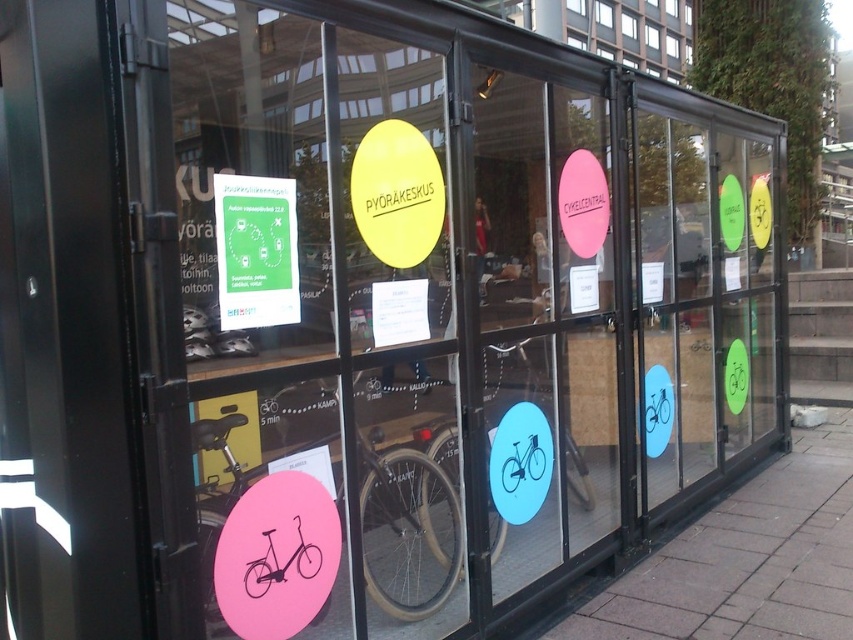
Question: Which of the following is the closest to the observer?

Choices:
 (A) (202, 522)
 (B) (532, 472)
 (C) (582, 317)
 (D) (682, 42)

Answer: (A)

Question: Is green matte bicycle at right to the left of pink matte bicycle at lower left from the viewer's perspective?

Choices:
 (A) yes
 (B) no

Answer: (B)

Question: Can you confirm if pink matte sign at center is thinner than pink matte bicycle at lower left?

Choices:
 (A) yes
 (B) no

Answer: (A)

Question: Does pink matte bicycle at lower left have a smaller size compared to clear glass window at upper center?

Choices:
 (A) yes
 (B) no

Answer: (A)

Question: Which of these objects is positioned closest to the green matte bicycle at right?

Choices:
 (A) clear glass window at upper center
 (B) pink matte bicycle at lower left

Answer: (B)

Question: Which of the following is the farthest from the observer?

Choices:
 (A) (671, 115)
 (B) (531, 496)
 (C) (582, 433)

Answer: (A)